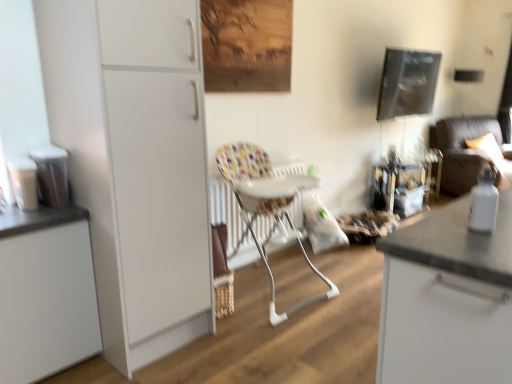
You are a GUI agent. You are given a task and a screenshot of the screen. Output one action in this format:
    pyautogui.click(x=<x>, y=<y>)
    Task: Click on the free location to the right of matte plastic containers at left, arranged as the 1th appliance when viewed from the left
    The height and width of the screenshot is (384, 512).
    Given the screenshot: What is the action you would take?
    pyautogui.click(x=58, y=216)